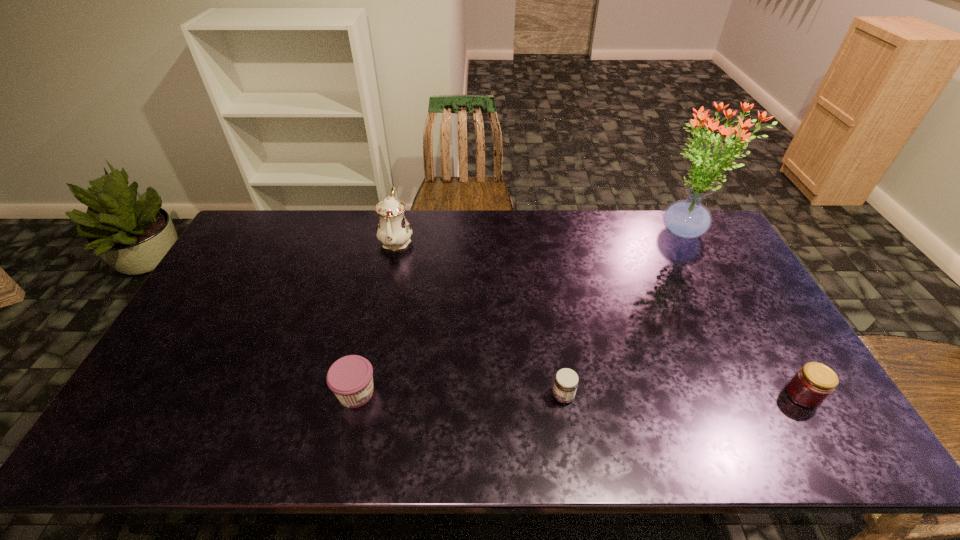
I want to click on free space at the right edge, so click(x=689, y=262).

Locate an element on the screen. The height and width of the screenshot is (540, 960). vacant space that's between the rightmost jam and the tallest object is located at coordinates (743, 314).

This screenshot has height=540, width=960. In order to click on free space between the rightmost jam and the flower arrangement in this screenshot , I will do (x=743, y=314).

The width and height of the screenshot is (960, 540). In order to click on empty location between the chinaware and the leftmost jam in this screenshot , I will do `click(376, 316)`.

Find the location of a particular element. vacant region between the second jam from right to left and the chinaware is located at coordinates (480, 318).

Image resolution: width=960 pixels, height=540 pixels. What are the coordinates of `vacant point located between the second jam from right to left and the fourth shortest object` in the screenshot? It's located at (480, 318).

Locate an element on the screen. The width and height of the screenshot is (960, 540). empty space that is in between the rightmost jam and the second tallest object is located at coordinates (599, 318).

This screenshot has width=960, height=540. Identify the location of free area in between the tallest object and the rightmost jam. (743, 314).

Locate an element on the screen. free space that is in between the flower arrangement and the second jam from right to left is located at coordinates (623, 315).

Image resolution: width=960 pixels, height=540 pixels. Identify the location of vacant area that lies between the fourth shortest object and the leftmost jam. (376, 316).